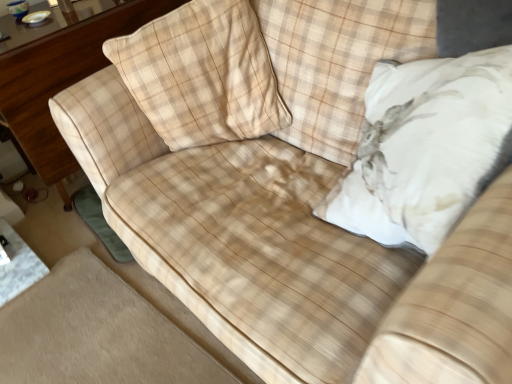
Question: Relative to wooden dresser at left, is beige plaid pillow at upper left, marked as the 2th throw pillow in a right-to-left arrangement, in front or behind?

Choices:
 (A) behind
 (B) front

Answer: (B)

Question: From the image's perspective, relative to wooden dresser at left, is beige plaid pillow at upper left, marked as the 2th throw pillow in a right-to-left arrangement, above or below?

Choices:
 (A) below
 (B) above

Answer: (A)

Question: Considering the real-world distances, which object is closest to the wooden dresser at left?

Choices:
 (A) white plush pillow at upper right, which is the second throw pillow in left-to-right order
 (B) beige plaid pillow at upper left, the first throw pillow in the left-to-right sequence

Answer: (B)

Question: Which object is positioned closest to the wooden dresser at left?

Choices:
 (A) beige plaid pillow at upper left, marked as the 2th throw pillow in a right-to-left arrangement
 (B) white plush pillow at upper right, which is the second throw pillow in left-to-right order

Answer: (A)